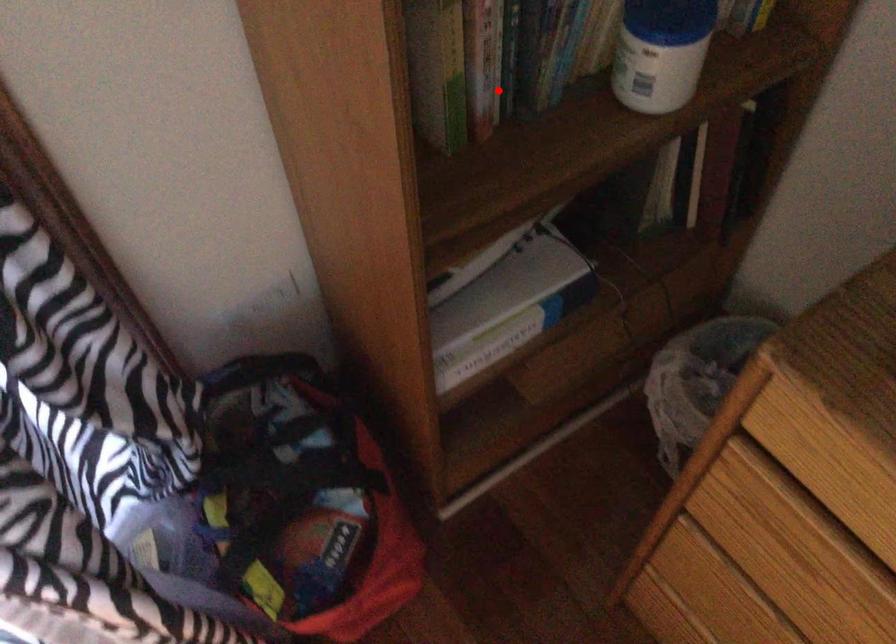
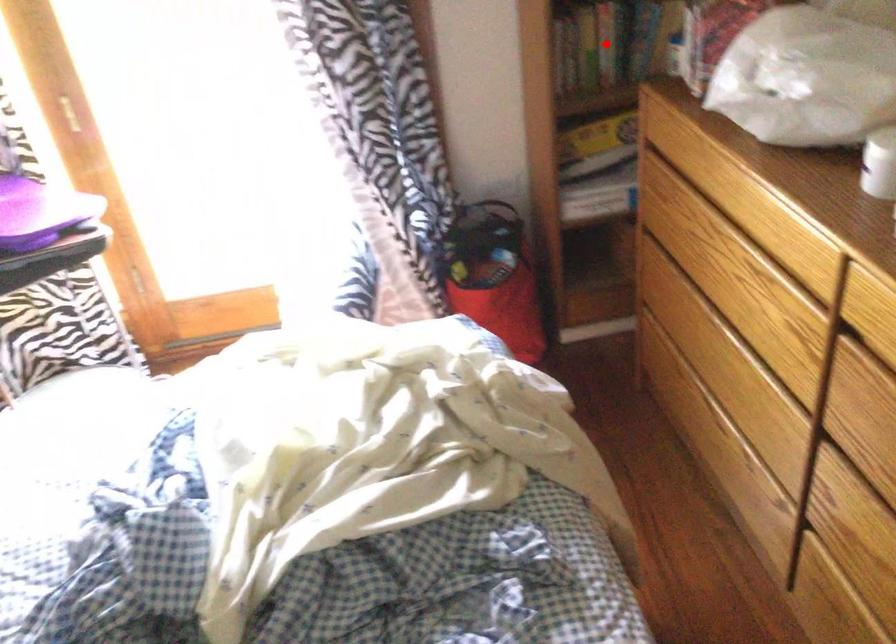
I am providing you with two images of the same scene from different viewpoints. A red point is marked on the first image and another point is marked on the second image. Is the marked point in image1 the same physical position as the marked point in image2?

Yes